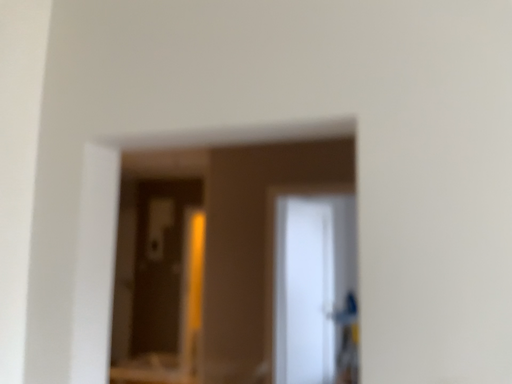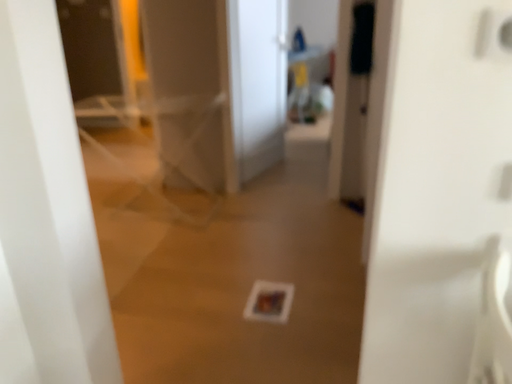
Question: How did the camera likely rotate when shooting the video?

Choices:
 (A) rotated upward
 (B) rotated downward

Answer: (B)